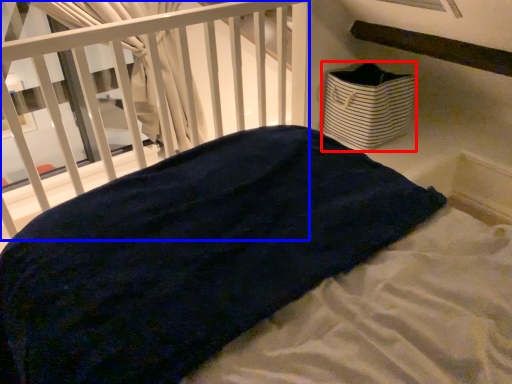
Question: Which object appears closest to the camera in this image, basket (highlighted by a red box) or infant bed (highlighted by a blue box)?

Choices:
 (A) basket
 (B) infant bed

Answer: (B)